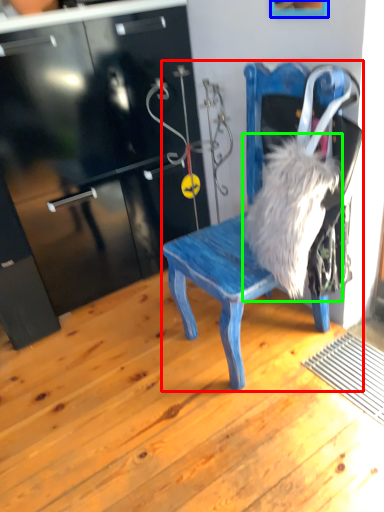
Question: Which object is the closest to the chair (highlighted by a red box)? Choose among these: picture frame (highlighted by a blue box) or animal (highlighted by a green box).

Choices:
 (A) picture frame
 (B) animal

Answer: (B)